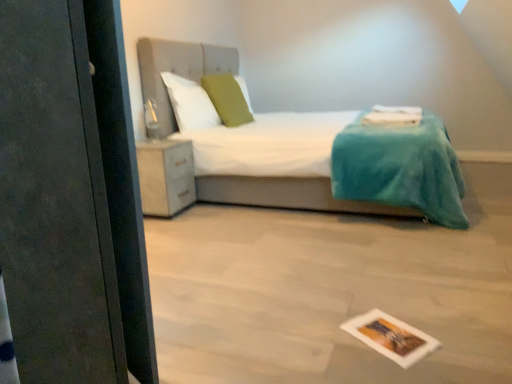
Locate an element on the screen. The image size is (512, 384). vacant area located to the right-hand side of printed paper postcard at lower center is located at coordinates (448, 333).